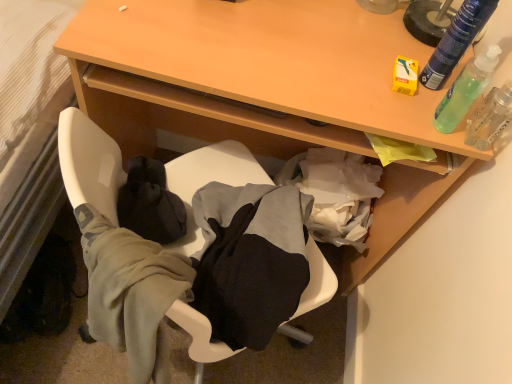
The height and width of the screenshot is (384, 512). I want to click on free space in front of green translucent bottle at upper right, the 1th bottle positioned from the top, so click(411, 111).